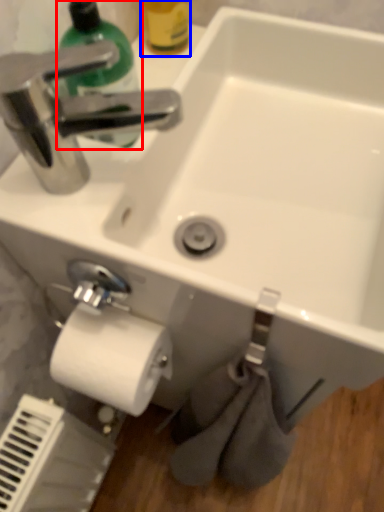
Question: Which object is closer to the camera taking this photo, cleaning product (highlighted by a red box) or bottle (highlighted by a blue box)?

Choices:
 (A) cleaning product
 (B) bottle

Answer: (A)